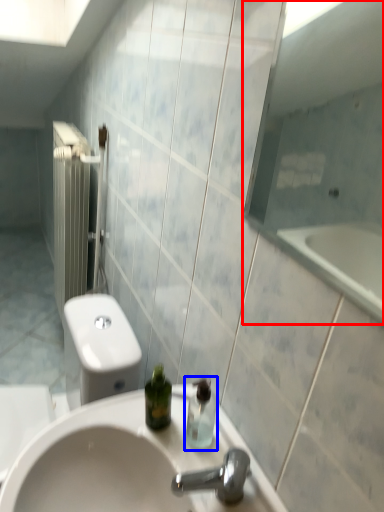
Question: Which object is closer to the camera taking this photo, mirror (highlighted by a red box) or soap dispenser (highlighted by a blue box)?

Choices:
 (A) mirror
 (B) soap dispenser

Answer: (A)